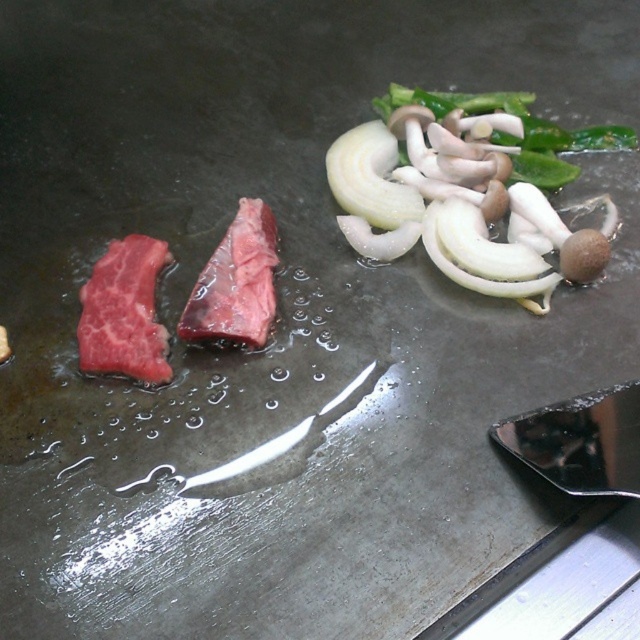
The image size is (640, 640). Identify the location of red raw steak at left. (124, 312).

Can you confirm if red raw steak at left is taller than pink raw steak at center?

No, red raw steak at left is not taller than pink raw steak at center.

Describe the element at coordinates (124, 312) in the screenshot. This screenshot has height=640, width=640. I see `red raw steak at left` at that location.

You are a GUI agent. You are given a task and a screenshot of the screen. Output one action in this format:
    pyautogui.click(x=<x>, y=<y>)
    Task: Click on the red raw steak at left
    This screenshot has height=640, width=640.
    Given the screenshot: What is the action you would take?
    pyautogui.click(x=124, y=312)

How far apart are white translucent onion at upper right and pink raw steak at center?

They are 13.53 inches apart.

Which of these two, white translucent onion at upper right or pink raw steak at center, stands shorter?

With less height is pink raw steak at center.

Who is more forward, (596, 266) or (260, 294)?

Positioned in front is point (260, 294).

The image size is (640, 640). Find the location of `white translucent onion at upper right`. white translucent onion at upper right is located at coordinates (458, 204).

Which is more to the right, white translucent onion at upper right or red raw steak at left?

white translucent onion at upper right

Is the position of white translucent onion at upper right less distant than that of red raw steak at left?

No, white translucent onion at upper right is further to the viewer.

Find the location of a particular element. white translucent onion at upper right is located at coordinates (458, 204).